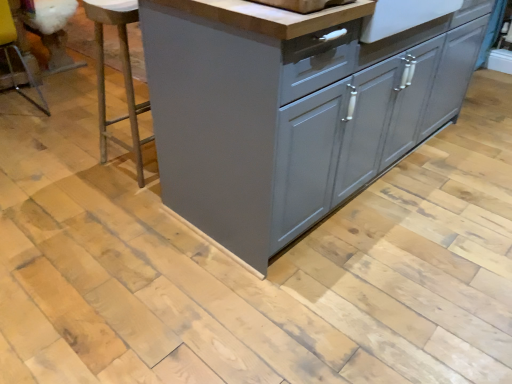
Question: From a real-world perspective, is clear plastic bar stool at left, the first bar stool viewed from the left, on matte gray cabinet at center?

Choices:
 (A) no
 (B) yes

Answer: (A)

Question: Is clear plastic bar stool at left, the second bar stool viewed from the right, beside matte gray cabinet at center?

Choices:
 (A) yes
 (B) no

Answer: (B)

Question: From a real-world perspective, is clear plastic bar stool at left, the first bar stool viewed from the left, beneath matte gray cabinet at center?

Choices:
 (A) yes
 (B) no

Answer: (A)

Question: Is clear plastic bar stool at left, the second bar stool viewed from the right, not close to matte gray cabinet at center?

Choices:
 (A) yes
 (B) no

Answer: (A)

Question: From the image's perspective, is clear plastic bar stool at left, the first bar stool viewed from the left, located beneath matte gray cabinet at center?

Choices:
 (A) no
 (B) yes

Answer: (A)

Question: Considering their positions, is clear plastic bar stool at left, the first bar stool viewed from the left, located in front of or behind metallic silver bar stool at left, which is counted as the first bar stool, starting from the right?

Choices:
 (A) behind
 (B) front

Answer: (A)

Question: Based on their positions, is clear plastic bar stool at left, the second bar stool viewed from the right, located to the left or right of metallic silver bar stool at left, acting as the 2th bar stool starting from the left?

Choices:
 (A) left
 (B) right

Answer: (A)

Question: In terms of height, does clear plastic bar stool at left, the second bar stool viewed from the right, look taller or shorter compared to metallic silver bar stool at left, acting as the 2th bar stool starting from the left?

Choices:
 (A) short
 (B) tall

Answer: (A)

Question: From the image's perspective, is clear plastic bar stool at left, the first bar stool viewed from the left, located above or below metallic silver bar stool at left, acting as the 2th bar stool starting from the left?

Choices:
 (A) below
 (B) above

Answer: (B)

Question: In the image, is matte gray cabinet at center on the left side or the right side of clear plastic bar stool at left, the first bar stool viewed from the left?

Choices:
 (A) left
 (B) right

Answer: (B)

Question: From a real-world perspective, is matte gray cabinet at center positioned above or below clear plastic bar stool at left, the second bar stool viewed from the right?

Choices:
 (A) below
 (B) above

Answer: (B)

Question: Relative to clear plastic bar stool at left, the second bar stool viewed from the right, is matte gray cabinet at center in front or behind?

Choices:
 (A) front
 (B) behind

Answer: (A)

Question: Is matte gray cabinet at center spatially inside clear plastic bar stool at left, the second bar stool viewed from the right, or outside of it?

Choices:
 (A) inside
 (B) outside

Answer: (B)

Question: From a real-world perspective, relative to matte gray cabinet at center, is metallic silver bar stool at left, which is counted as the first bar stool, starting from the right, vertically above or below?

Choices:
 (A) below
 (B) above

Answer: (A)

Question: From the image's perspective, is metallic silver bar stool at left, acting as the 2th bar stool starting from the left, located above or below matte gray cabinet at center?

Choices:
 (A) below
 (B) above

Answer: (A)